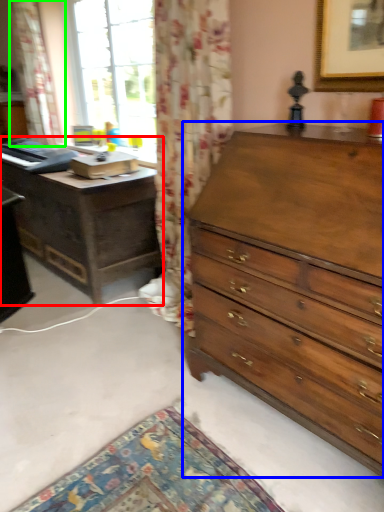
Question: Which is nearer to the nightstand (highlighted by a red box)? chest of drawers (highlighted by a blue box) or curtain (highlighted by a green box).

Choices:
 (A) chest of drawers
 (B) curtain

Answer: (B)